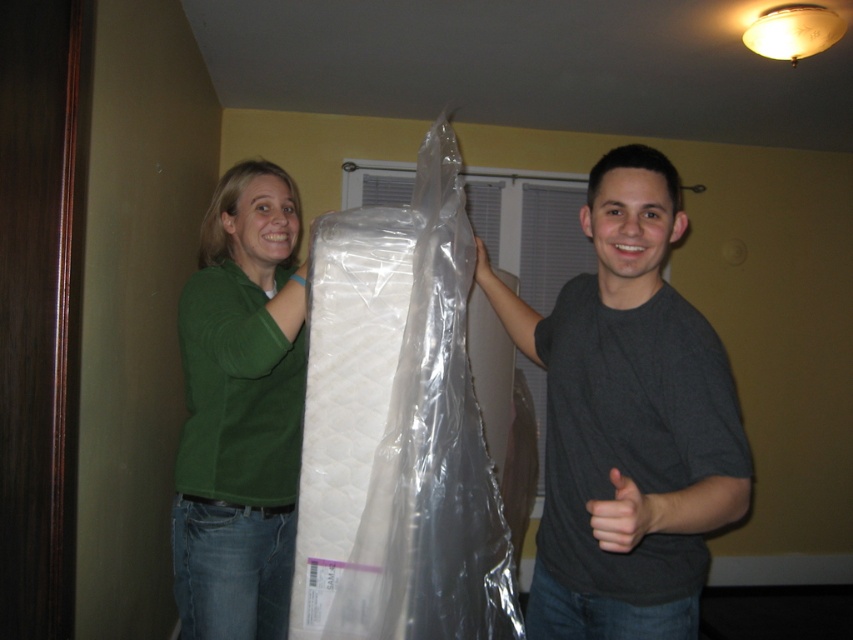
Question: Considering the real-world distances, which object is farthest from the clear plastic mattress at center?

Choices:
 (A) dark gray t-shirt at center
 (B) green matte shirt at center

Answer: (A)

Question: Does dark gray t-shirt at center appear under green matte shirt at center?

Choices:
 (A) no
 (B) yes

Answer: (A)

Question: Which of these objects is positioned closest to the dark gray t-shirt at center?

Choices:
 (A) clear plastic mattress at center
 (B) green matte shirt at center

Answer: (A)

Question: Which object is positioned farthest from the dark gray t-shirt at center?

Choices:
 (A) green matte shirt at center
 (B) clear plastic mattress at center

Answer: (A)

Question: Does clear plastic mattress at center have a greater width compared to green matte shirt at center?

Choices:
 (A) yes
 (B) no

Answer: (B)

Question: Is clear plastic mattress at center smaller than green matte shirt at center?

Choices:
 (A) yes
 (B) no

Answer: (A)